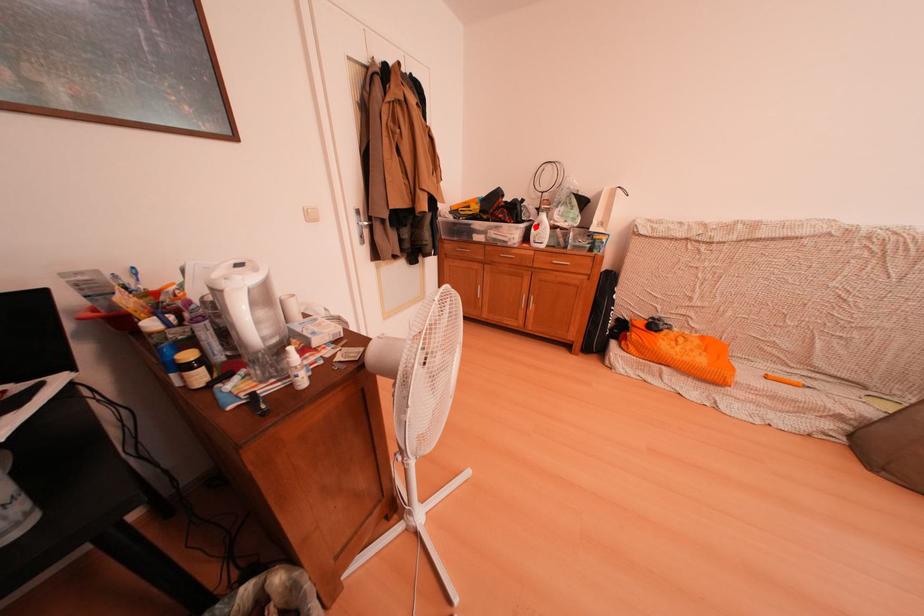
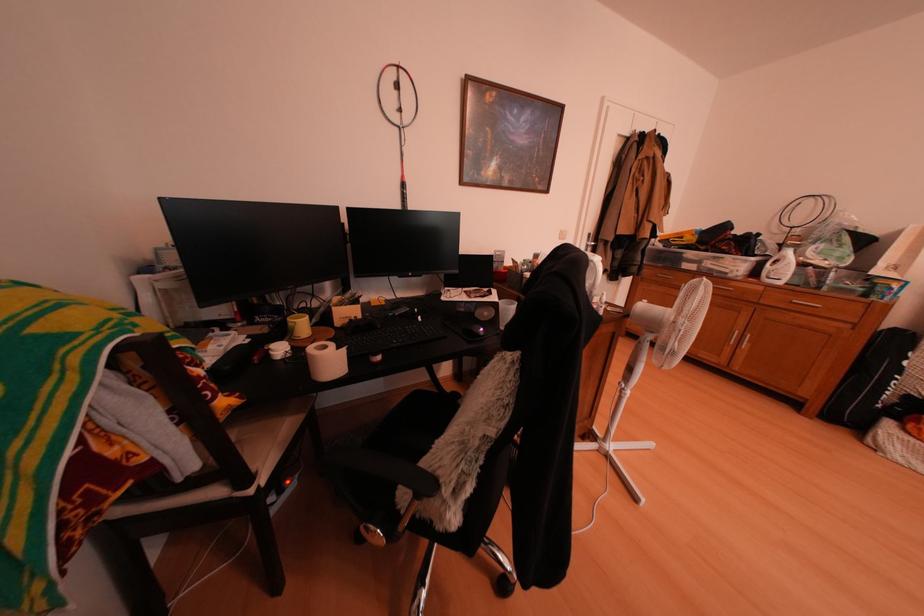
The point at the highlighted location is marked in the first image. Where is the corresponding point in the second image?

(767, 261)